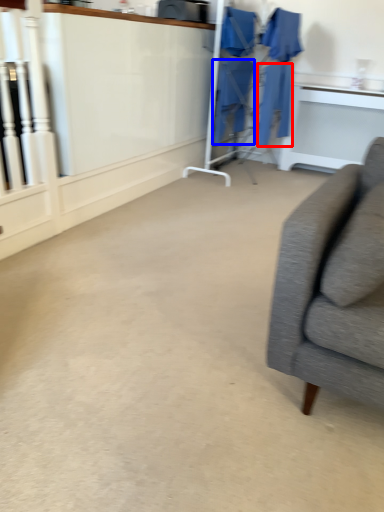
Question: Which object appears farthest to the camera in this image, robe (highlighted by a red box) or robe (highlighted by a blue box)?

Choices:
 (A) robe
 (B) robe

Answer: (B)